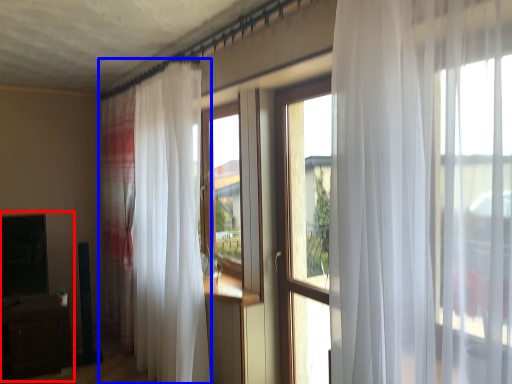
Question: Which object appears farthest to the camera in this image, entertainment center (highlighted by a red box) or curtain (highlighted by a blue box)?

Choices:
 (A) entertainment center
 (B) curtain

Answer: (A)